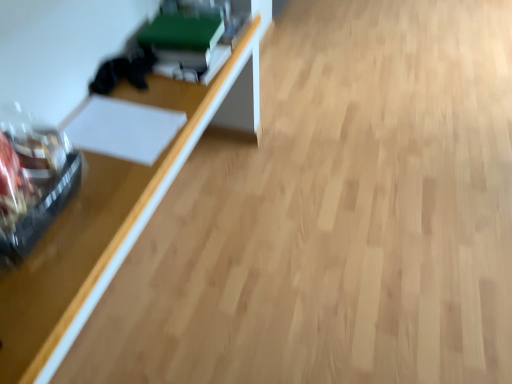
Describe the element at coordinates (99, 230) in the screenshot. The image size is (512, 384). I see `wooden table at left` at that location.

Identify the location of wooden table at left. (99, 230).

This screenshot has width=512, height=384. What are the coordinates of `wooden table at left` in the screenshot? It's located at (99, 230).